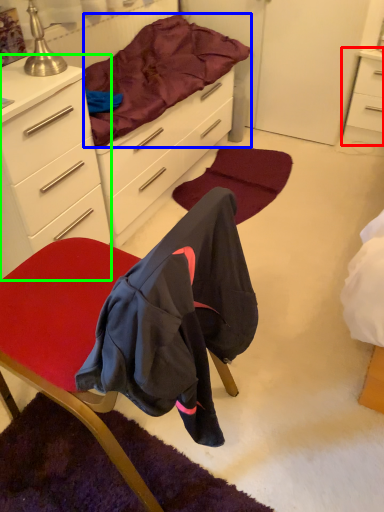
Question: Based on their relative distances, which object is nearer to nightstand (highlighted by a red box)? Choose from bedding (highlighted by a blue box) and cabinetry (highlighted by a green box).

Choices:
 (A) bedding
 (B) cabinetry

Answer: (A)